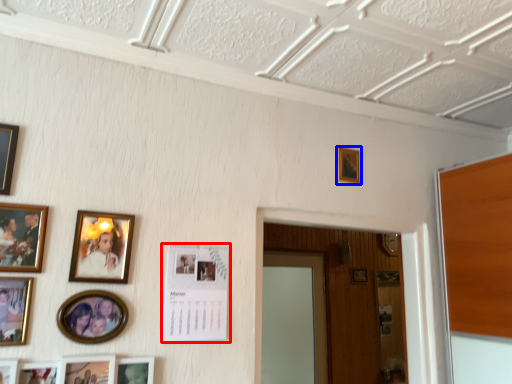
Question: Which object appears closest to the camera in this image, picture frame (highlighted by a red box) or picture frame (highlighted by a blue box)?

Choices:
 (A) picture frame
 (B) picture frame

Answer: (A)